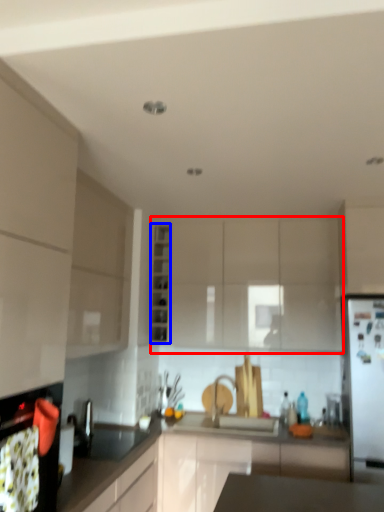
Question: Among these objects, which one is nearest to the camera, cabinetry (highlighted by a red box) or cabinetry (highlighted by a blue box)?

Choices:
 (A) cabinetry
 (B) cabinetry

Answer: (A)